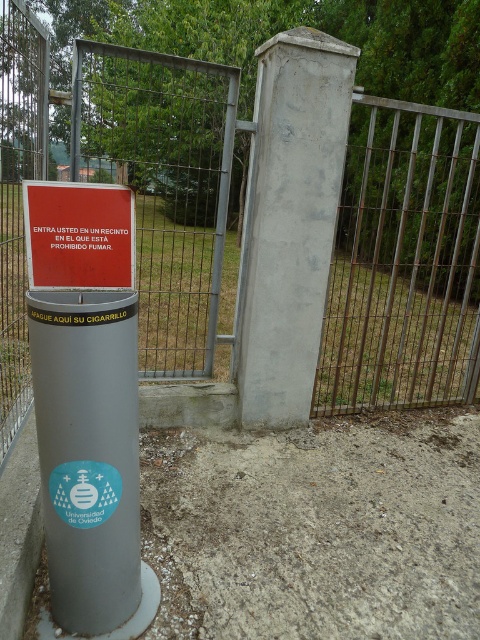
You are standing at the entrance of the fenced area and want to locate the metallic gate at center. According to the coordinates provided, where exactly should you look to find it?

The metallic gate at center is located at the coordinates point (x=404, y=260).

You are a maintenance worker needing to replace a part that fits through the metallic gate at center. The part is as wide as the red matte sign at center. Will the part fit through the gate?

The metallic gate at center is wider than the red matte sign at center, so the part, being as wide as the sign, will fit through the gate.

You are a visitor at the Universidad de Oviedo campus and need to locate the entrance. You see a metallic gate at center and a red matte sign at center. Which object is bigger?

The metallic gate at center is larger in size than the red matte sign at center.